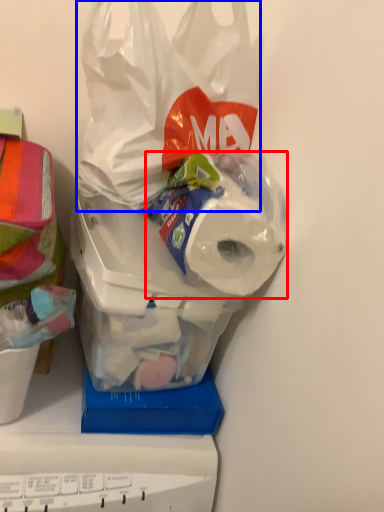
Question: Among these objects, which one is farthest to the camera, toilet paper (highlighted by a red box) or plastic bag (highlighted by a blue box)?

Choices:
 (A) toilet paper
 (B) plastic bag

Answer: (A)